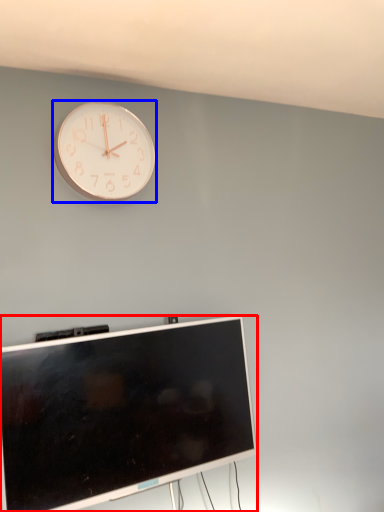
Question: Which of the following is the farthest to the observer, television (highlighted by a red box) or wall clock (highlighted by a blue box)?

Choices:
 (A) television
 (B) wall clock

Answer: (B)